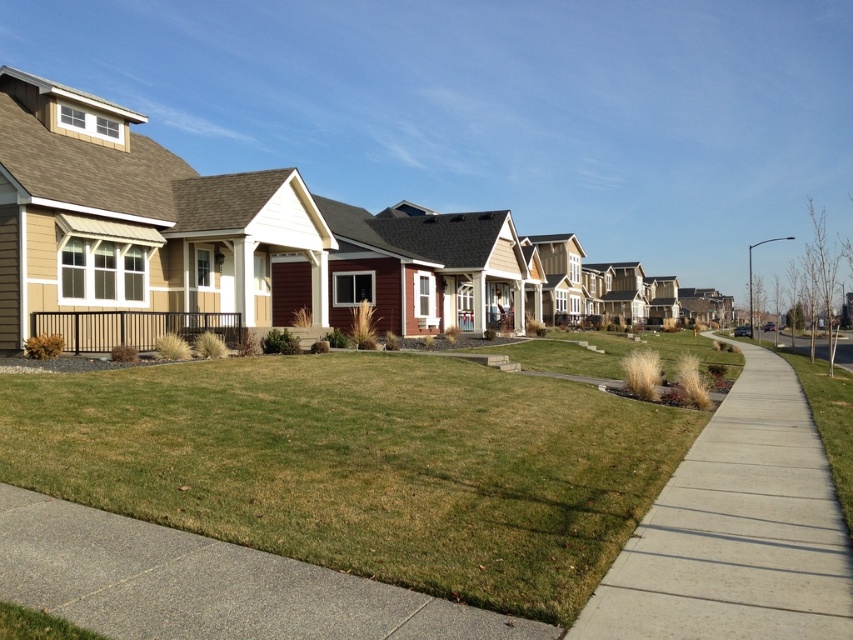
You are a delivery person trying to reach the first house on the right. You are currently standing on the gray concrete sidewalk at lower center. Which direction should you move relative to the green grass at center to get closer to the house?

Since the gray concrete sidewalk at lower center is behind the green grass at center, you should move forward away from the green grass at center to approach the house.

You are standing on the gray concrete sidewalk at lower center and want to walk towards the row of houses. In which direction should you go to reach the concrete sidewalk at center?

To reach the concrete sidewalk at center from the gray concrete sidewalk at lower center, you should walk towards the right since the concrete sidewalk at center is located to the right of the gray concrete sidewalk at lower center.

Consider the image. You are standing on the sidewalk in front of the suburban homes. You want to walk to the green grass at center. Which direction should you go from your current position?

The green grass at center is located at point coordinates of (x=361, y=465). Since you are on the sidewalk, which is parallel to the houses and curves to the right, you would need to move towards the center of the image to reach the green grass at center.